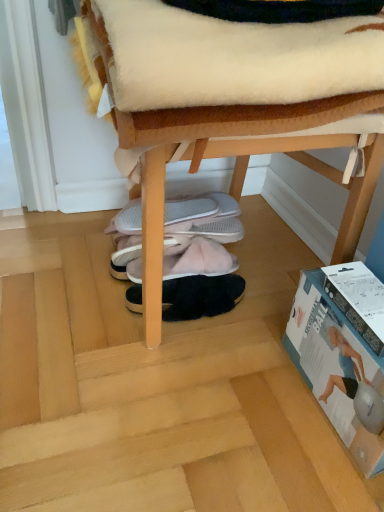
Question: From the image's perspective, does black fuzzy slippers at center, the first footwear ordered from the bottom, appear higher than wooden chair at center?

Choices:
 (A) no
 (B) yes

Answer: (A)

Question: Is black fuzzy slippers at center, which appears as the third footwear when viewed from the top, positioned with its back to wooden chair at center?

Choices:
 (A) yes
 (B) no

Answer: (A)

Question: Does black fuzzy slippers at center, the first footwear ordered from the bottom, appear on the left side of wooden chair at center?

Choices:
 (A) yes
 (B) no

Answer: (A)

Question: Can you confirm if black fuzzy slippers at center, the first footwear ordered from the bottom, is smaller than wooden chair at center?

Choices:
 (A) no
 (B) yes

Answer: (B)

Question: Is black fuzzy slippers at center, which appears as the third footwear when viewed from the top, with wooden chair at center?

Choices:
 (A) no
 (B) yes

Answer: (A)

Question: Do you think wooden chair at center is within white fabric slippers at center, which is the third footwear from bottom to top, or outside of it?

Choices:
 (A) inside
 (B) outside

Answer: (B)

Question: Considering the positions of wooden chair at center and white fabric slippers at center, which is the third footwear from bottom to top, in the image, is wooden chair at center taller or shorter than white fabric slippers at center, which is the third footwear from bottom to top,?

Choices:
 (A) short
 (B) tall

Answer: (B)

Question: In terms of width, does wooden chair at center look wider or thinner when compared to white fabric slippers at center, which is the third footwear from bottom to top?

Choices:
 (A) wide
 (B) thin

Answer: (A)

Question: Based on their positions, is wooden chair at center located to the left or right of white fabric slippers at center, the first footwear viewed from the top?

Choices:
 (A) left
 (B) right

Answer: (B)

Question: In the image, is black fuzzy slippers at center, which appears as the third footwear when viewed from the top, positioned in front of or behind white fabric slippers at center, which is the third footwear from bottom to top?

Choices:
 (A) behind
 (B) front

Answer: (B)

Question: In terms of size, does black fuzzy slippers at center, the first footwear ordered from the bottom, appear bigger or smaller than white fabric slippers at center, the first footwear viewed from the top?

Choices:
 (A) small
 (B) big

Answer: (A)

Question: Visually, is black fuzzy slippers at center, the first footwear ordered from the bottom, positioned to the left or to the right of white fabric slippers at center, the first footwear viewed from the top?

Choices:
 (A) left
 (B) right

Answer: (B)

Question: Which is correct: black fuzzy slippers at center, which appears as the third footwear when viewed from the top, is inside white fabric slippers at center, the first footwear viewed from the top, or outside of it?

Choices:
 (A) outside
 (B) inside

Answer: (A)

Question: From a real-world perspective, is white fabric slippers at center, which is the third footwear from bottom to top, above or below wooden chair at center?

Choices:
 (A) above
 (B) below

Answer: (B)

Question: In the image, is white fabric slippers at center, the first footwear viewed from the top, positioned in front of or behind wooden chair at center?

Choices:
 (A) behind
 (B) front

Answer: (A)